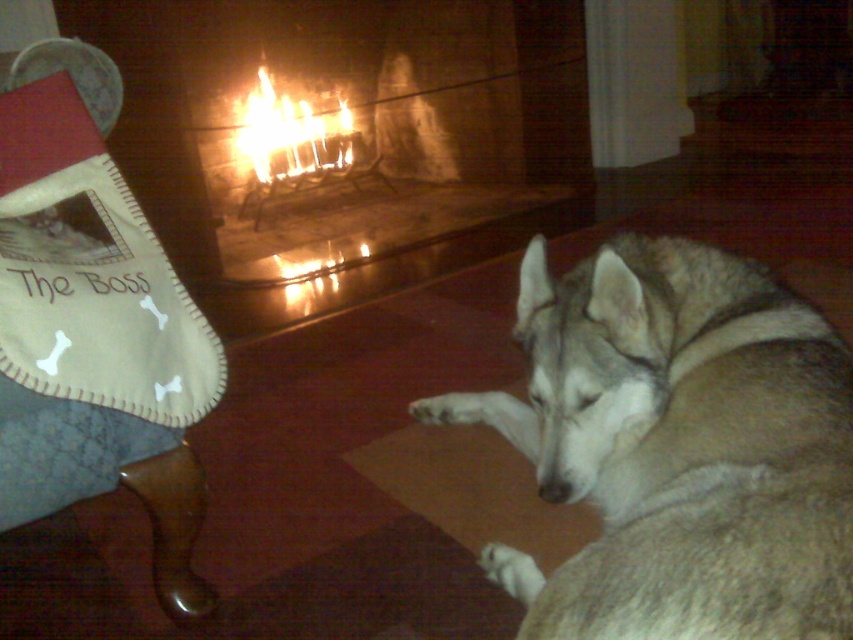
You are standing in the room shown in the image. You want to place a small decorative item at the point with coordinates point (677,448). Where exactly will this item be placed?

The point (677,448) corresponds to the fuzzy gray dog at lower right, so placing the item there would put it directly on the fuzzy gray dog at lower right.

You are planning to place a new dog bed for the fuzzy gray dog at lower right. The brick fireplace at center is currently taking up most of the space. Is the dog bed likely to fit in the remaining space next to the fireplace?

The fuzzy gray dog at lower right is narrower than the brick fireplace at center, so there might be enough space left to place the dog bed next to the fireplace.